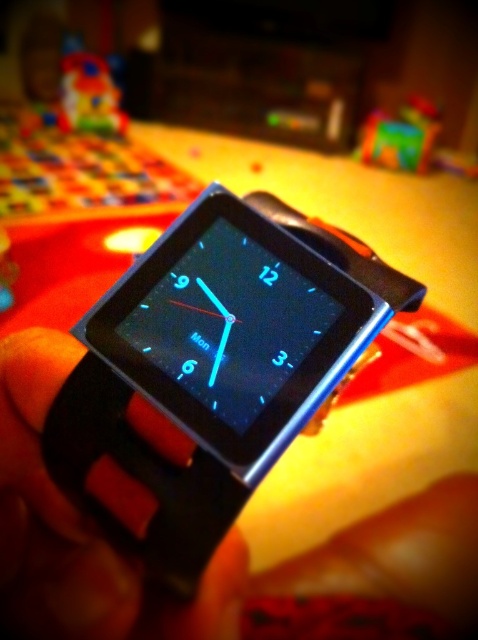
Who is lower down, black matte watch at center or plastic toy at upper left?

black matte watch at center is below.

Is point (212, 353) closer to camera compared to point (61, 125)?

Yes, it is in front of point (61, 125).

Who is more distant from viewer, (214, 340) or (120, 112)?

Point (120, 112)

This screenshot has width=478, height=640. In order to click on black matte watch at center in this screenshot , I will do `click(212, 371)`.

Is rubberized plastic toy at upper right shorter than plastic toy at upper left?

Yes.

Is rubberized plastic toy at upper right positioned behind plastic toy at upper left?

That is False.

Describe the element at coordinates (400, 136) in the screenshot. This screenshot has height=640, width=478. I see `rubberized plastic toy at upper right` at that location.

Find the location of a particular element. This screenshot has height=640, width=478. rubberized plastic toy at upper right is located at coordinates (400, 136).

Between black rubber watch at center and plastic toy at upper left, which one is positioned lower?

black rubber watch at center

Measure the distance between black rubber watch at center and camera.

They are 36.64 inches apart.

Locate an element on the screen. This screenshot has width=478, height=640. black rubber watch at center is located at coordinates (79, 529).